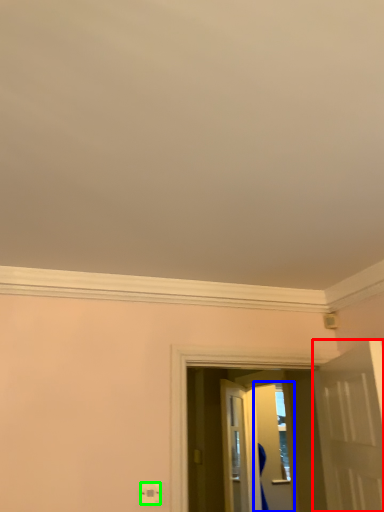
Question: Which object is the closest to the door (highlighted by a red box)? Choose among these: screen door (highlighted by a blue box) or electric outlet (highlighted by a green box).

Choices:
 (A) screen door
 (B) electric outlet

Answer: (B)